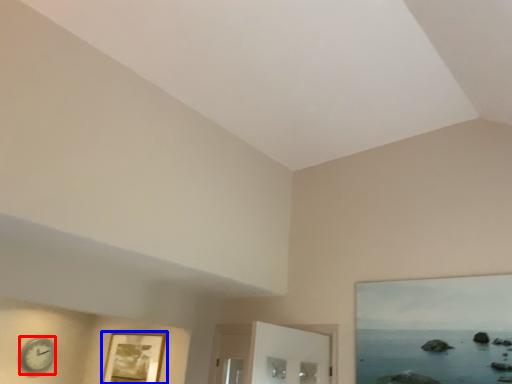
Question: Which object is closer to the camera taking this photo, clock (highlighted by a red box) or picture frame (highlighted by a blue box)?

Choices:
 (A) clock
 (B) picture frame

Answer: (B)